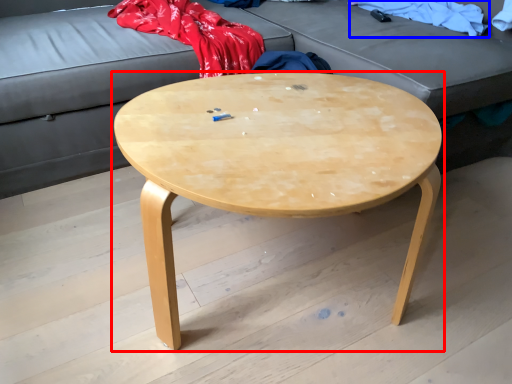
Question: Which object appears closest to the camera in this image, coffee table (highlighted by a red box) or clothing (highlighted by a blue box)?

Choices:
 (A) coffee table
 (B) clothing

Answer: (A)